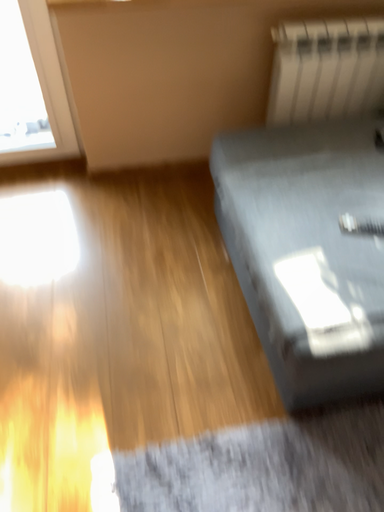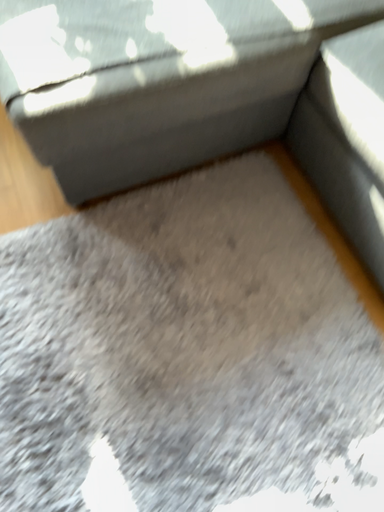
Question: How did the camera likely rotate when shooting the video?

Choices:
 (A) rotated downward
 (B) rotated upward

Answer: (A)